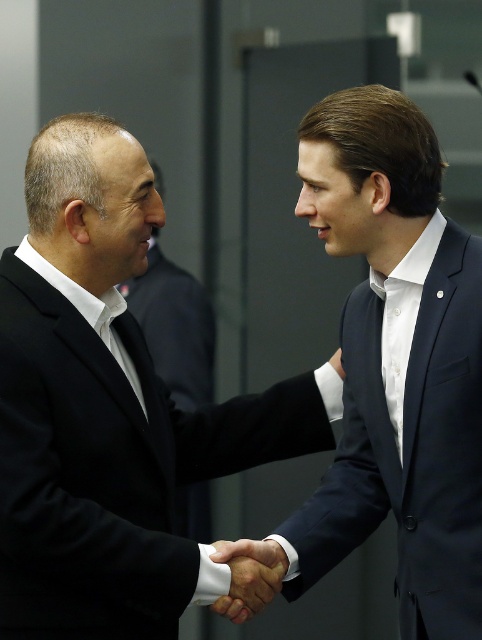
Question: In this image, where is black matte suit at left located relative to navy blue suit at center?

Choices:
 (A) above
 (B) below

Answer: (B)

Question: Does black matte suit at left have a smaller size compared to smooth skin handshake at center?

Choices:
 (A) no
 (B) yes

Answer: (A)

Question: Which object is positioned closest to the navy blue suit at center?

Choices:
 (A) black matte suit at left
 (B) matte black suit at left
 (C) smooth skin handshake at center

Answer: (C)

Question: From the image, what is the correct spatial relationship of black matte suit at left in relation to navy blue suit at center?

Choices:
 (A) below
 (B) above

Answer: (A)

Question: Considering the real-world distances, which object is closest to the smooth skin handshake at center?

Choices:
 (A) navy blue suit at center
 (B) matte black suit at left

Answer: (A)

Question: Among these objects, which one is nearest to the camera?

Choices:
 (A) black matte suit at left
 (B) navy blue suit at center
 (C) matte black suit at left

Answer: (A)